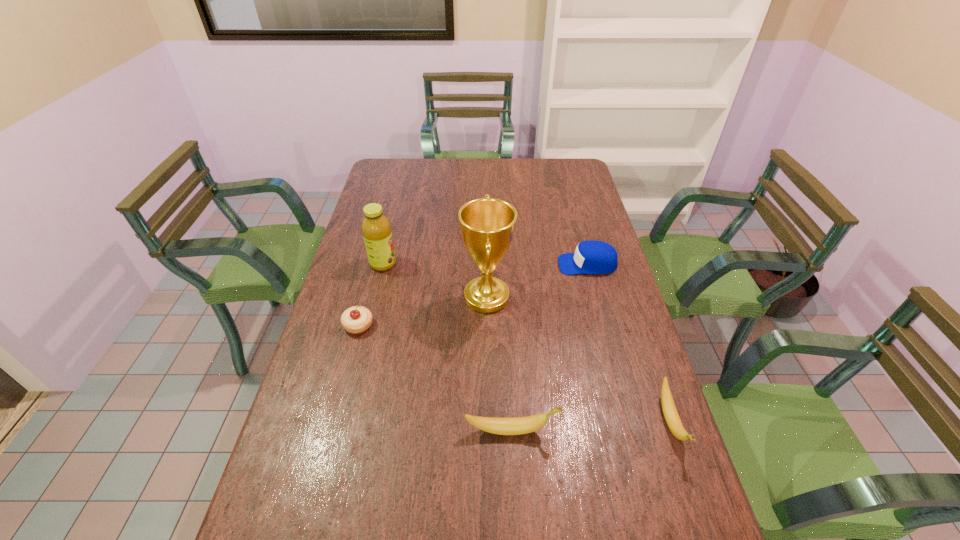
Locate an element on the screen. The width and height of the screenshot is (960, 540). free space for a new banana on the left is located at coordinates (346, 440).